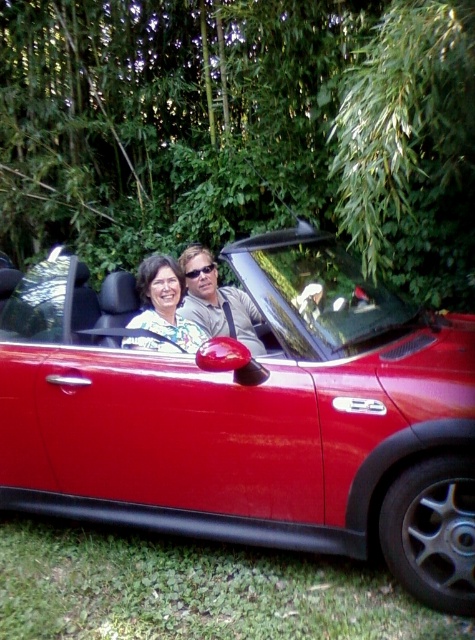
Question: Is glossy red car at center wider than matte black couple at center?

Choices:
 (A) yes
 (B) no

Answer: (A)

Question: Which point is farther to the camera?

Choices:
 (A) matte black couple at center
 (B) glossy red car at center

Answer: (A)

Question: Can you confirm if glossy red car at center is wider than matte black couple at center?

Choices:
 (A) yes
 (B) no

Answer: (A)

Question: Is glossy red car at center thinner than matte black couple at center?

Choices:
 (A) yes
 (B) no

Answer: (B)

Question: Which object is closer to the camera taking this photo?

Choices:
 (A) glossy red car at center
 (B) matte black couple at center

Answer: (A)